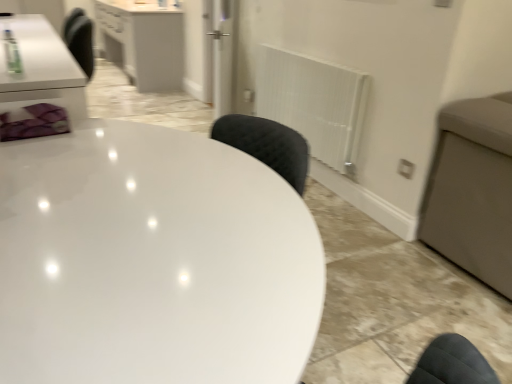
Question: Can you confirm if white glossy cabinet at upper left is shorter than white textured radiator at center right?

Choices:
 (A) no
 (B) yes

Answer: (A)

Question: Could you tell me if white glossy cabinet at upper left is turned towards white textured radiator at center right?

Choices:
 (A) no
 (B) yes

Answer: (A)

Question: From the image's perspective, does white glossy cabinet at upper left appear higher than white textured radiator at center right?

Choices:
 (A) no
 (B) yes

Answer: (B)

Question: Can you confirm if white glossy cabinet at upper left is smaller than white textured radiator at center right?

Choices:
 (A) yes
 (B) no

Answer: (B)

Question: From a real-world perspective, is white glossy cabinet at upper left positioned over white textured radiator at center right based on gravity?

Choices:
 (A) yes
 (B) no

Answer: (B)

Question: Is white glossy cabinet at upper left thinner than white textured radiator at center right?

Choices:
 (A) no
 (B) yes

Answer: (A)

Question: Does white glossy table at center appear on the right side of white textured radiator at center right?

Choices:
 (A) yes
 (B) no

Answer: (B)

Question: From the image's perspective, is white glossy table at center below white textured radiator at center right?

Choices:
 (A) no
 (B) yes

Answer: (B)

Question: From the image's perspective, is white glossy table at center above white textured radiator at center right?

Choices:
 (A) yes
 (B) no

Answer: (B)

Question: Is the position of white glossy table at center less distant than that of white textured radiator at center right?

Choices:
 (A) yes
 (B) no

Answer: (A)

Question: Is white textured radiator at center right completely or partially inside white glossy table at center?

Choices:
 (A) no
 (B) yes

Answer: (A)

Question: Can you confirm if white glossy table at center is smaller than white textured radiator at center right?

Choices:
 (A) no
 (B) yes

Answer: (A)

Question: Is white glossy cabinet at upper left smaller than transparent glass door at center?

Choices:
 (A) no
 (B) yes

Answer: (A)